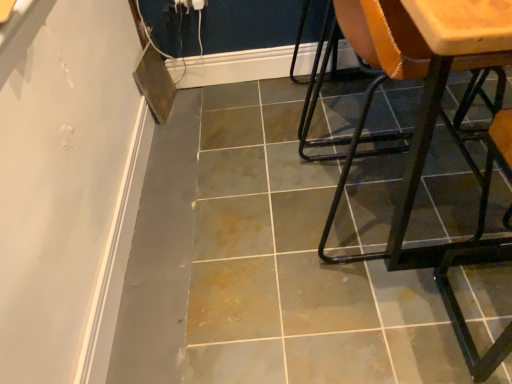
Where is `free space to the left of matte orange chair at right, positioned as the third chair in right-to-left order`? free space to the left of matte orange chair at right, positioned as the third chair in right-to-left order is located at coordinates (246, 130).